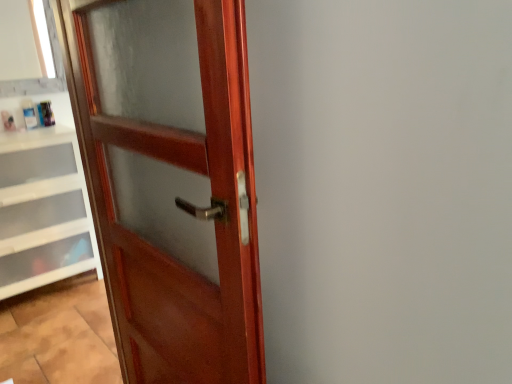
Question: Considering the positions of glossy wood door at left and white plastic drawers at lower left in the image, is glossy wood door at left bigger or smaller than white plastic drawers at lower left?

Choices:
 (A) big
 (B) small

Answer: (B)

Question: From a real-world perspective, is glossy wood door at left physically located above or below white plastic drawers at lower left?

Choices:
 (A) above
 (B) below

Answer: (A)

Question: Considering the real-world distances, which object is farthest from the white plastic drawers at lower left?

Choices:
 (A) matte wood window frame at upper left
 (B) glossy wood door at left

Answer: (B)

Question: Considering the real-world distances, which object is farthest from the matte wood window frame at upper left?

Choices:
 (A) white plastic drawers at lower left
 (B) glossy wood door at left

Answer: (B)